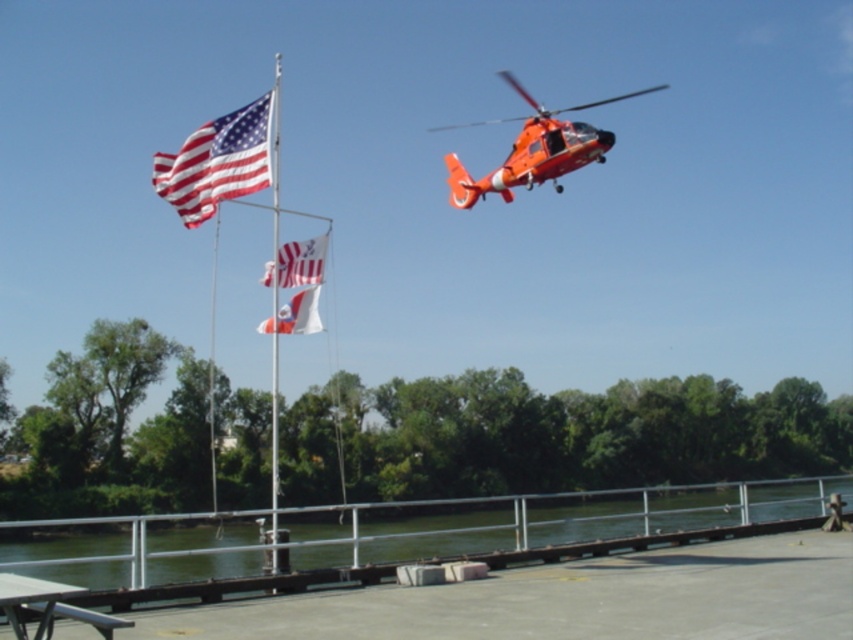
Who is lower down, orange matte helicopter at upper center or metallic silver picnic table at lower left?

metallic silver picnic table at lower left

Does point (598, 134) lie behind point (13, 609)?

Yes, point (598, 134) is farther from viewer.

The image size is (853, 640). What are the coordinates of `orange matte helicopter at upper center` in the screenshot? It's located at (534, 148).

Can you confirm if metallic flag pole at center is positioned below white fabric flag at upper center?

No.

Is metallic flag pole at center to the left of white fabric flag at upper center from the viewer's perspective?

Yes, metallic flag pole at center is to the left of white fabric flag at upper center.

Is point (271, 237) in front of point (289, 280)?

That is False.

Locate an element on the screen. This screenshot has width=853, height=640. metallic flag pole at center is located at coordinates (274, 305).

How far apart are orange matte helicopter at upper center and white fabric flag at upper center?

orange matte helicopter at upper center and white fabric flag at upper center are 114.66 meters apart from each other.

Between point (576, 108) and point (294, 260), which one is positioned in front?

Point (294, 260) is more forward.

The image size is (853, 640). What do you see at coordinates (534, 148) in the screenshot?
I see `orange matte helicopter at upper center` at bounding box center [534, 148].

Locate an element on the screen. orange matte helicopter at upper center is located at coordinates (534, 148).